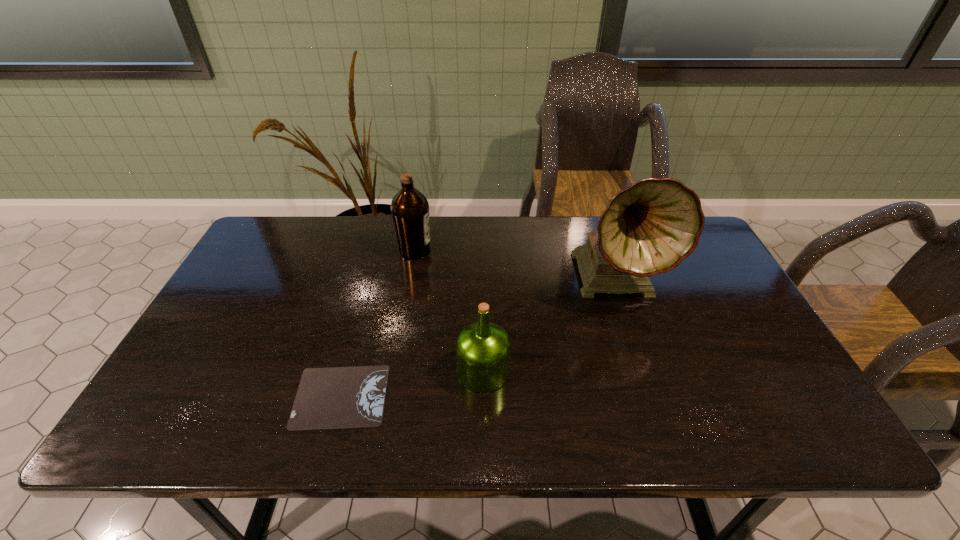
Identify the location of vacant space located 0.190m on the left of the shortest object. (210, 396).

Find the location of a particular element. The width and height of the screenshot is (960, 540). record player that is at the far edge is located at coordinates (649, 228).

The height and width of the screenshot is (540, 960). I want to click on olive oil present at the far edge, so click(410, 209).

The height and width of the screenshot is (540, 960). I want to click on object that is at the near edge, so click(339, 397).

This screenshot has height=540, width=960. Find the location of `vacant space at the far edge`. vacant space at the far edge is located at coordinates (486, 231).

The height and width of the screenshot is (540, 960). In order to click on free spot at the near edge of the desktop in this screenshot , I will do `click(568, 415)`.

The width and height of the screenshot is (960, 540). Find the location of `vacant space at the left edge of the desktop`. vacant space at the left edge of the desktop is located at coordinates (243, 292).

I want to click on free location at the far right corner, so click(x=694, y=260).

Find the location of a particular element. This screenshot has width=960, height=540. vacant space at the near right corner of the desktop is located at coordinates (750, 426).

I want to click on vacant space that is in between the left olive oil and the mousepad, so click(x=378, y=323).